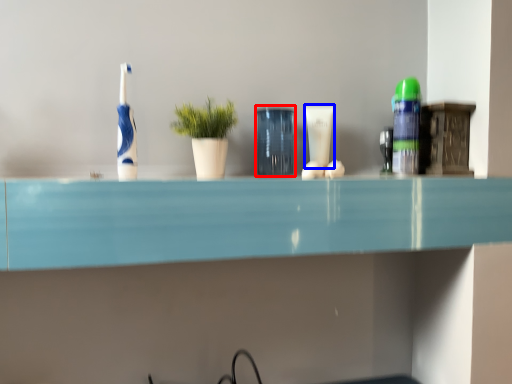
Question: Which point is closer to the camera, glass vase (highlighted by a red box) or toiletry (highlighted by a blue box)?

Choices:
 (A) glass vase
 (B) toiletry

Answer: (A)